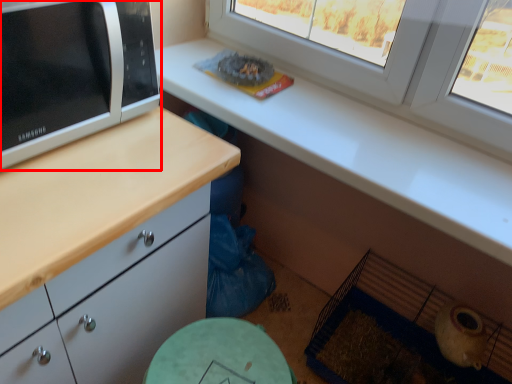
Question: From the image's perspective, what is the correct spatial relationship of microwave oven (annotated by the red box) in relation to window?

Choices:
 (A) below
 (B) above

Answer: (A)